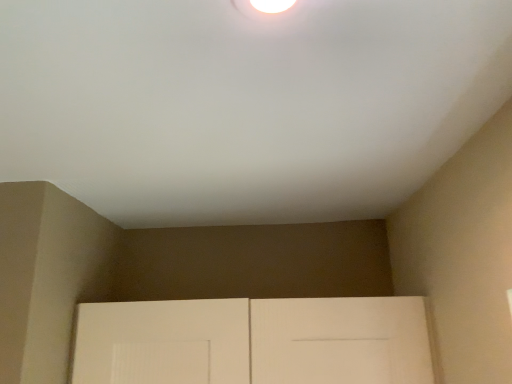
Image resolution: width=512 pixels, height=384 pixels. What do you see at coordinates (270, 10) in the screenshot? I see `white glossy droplight at upper center` at bounding box center [270, 10].

I want to click on white glossy droplight at upper center, so click(270, 10).

This screenshot has width=512, height=384. Find the location of `white matte door at lower center`. white matte door at lower center is located at coordinates (254, 341).

Describe the element at coordinates (254, 341) in the screenshot. I see `white matte door at lower center` at that location.

Find the location of `white glossy droplight at upper center`. white glossy droplight at upper center is located at coordinates (270, 10).

Would you say white matte door at lower center is to the left or to the right of white glossy droplight at upper center in the picture?

From the image, it's evident that white matte door at lower center is to the left of white glossy droplight at upper center.

In the image, is white matte door at lower center positioned in front of or behind white glossy droplight at upper center?

Clearly, white matte door at lower center is behind white glossy droplight at upper center.

Is point (166, 339) closer or farther from the camera than point (298, 11)?

Point (166, 339) is farther from the camera than point (298, 11).

From the image's perspective, is white matte door at lower center over white glossy droplight at upper center?

Incorrect, from the image's perspective, white matte door at lower center is lower than white glossy droplight at upper center.

From the picture: From a real-world perspective, is white matte door at lower center physically located above or below white glossy droplight at upper center?

white matte door at lower center is situated lower than white glossy droplight at upper center in the real world.

Is white matte door at lower center wider than white glossy droplight at upper center?

Indeed, white matte door at lower center has a greater width compared to white glossy droplight at upper center.

In the scene shown: Between white matte door at lower center and white glossy droplight at upper center, which one has less height?

Standing shorter between the two is white glossy droplight at upper center.

Can you confirm if white matte door at lower center is bigger than white glossy droplight at upper center?

Correct, white matte door at lower center is larger in size than white glossy droplight at upper center.

Would you say white matte door at lower center is outside white glossy droplight at upper center?

Yes, white matte door at lower center is located beyond the bounds of white glossy droplight at upper center.

Is white matte door at lower center next to white glossy droplight at upper center?

No, white matte door at lower center is not making contact with white glossy droplight at upper center.

Is white matte door at lower center aimed at white glossy droplight at upper center?

No, white matte door at lower center is not oriented towards white glossy droplight at upper center.

How many degrees apart are the facing directions of white matte door at lower center and white glossy droplight at upper center?

The facing directions of white matte door at lower center and white glossy droplight at upper center are 89.3 degrees apart.

Measure the distance from white matte door at lower center to white glossy droplight at upper center.

white matte door at lower center and white glossy droplight at upper center are 33.36 inches apart.

Where is `droplight above the white matte door at lower center (from a real-world perspective)`? droplight above the white matte door at lower center (from a real-world perspective) is located at coordinates (270, 10).

Considering the relative positions of white glossy droplight at upper center and white matte door at lower center in the image provided, is white glossy droplight at upper center to the left of white matte door at lower center from the viewer's perspective?

No, white glossy droplight at upper center is not to the left of white matte door at lower center.

Considering the relative positions of white glossy droplight at upper center and white matte door at lower center in the image provided, is white glossy droplight at upper center in front of white matte door at lower center?

That is True.

Does point (298, 3) come in front of point (412, 297)?

Yes, point (298, 3) is closer to viewer.

From the image's perspective, which one is positioned higher, white glossy droplight at upper center or white matte door at lower center?

white glossy droplight at upper center is shown above in the image.

From a real-world perspective, is white glossy droplight at upper center on top of white matte door at lower center?

Yes, from a real-world perspective, white glossy droplight at upper center is above white matte door at lower center.

Consider the image. Is white glossy droplight at upper center wider or thinner than white matte door at lower center?

In the image, white glossy droplight at upper center appears to be more narrow than white matte door at lower center.

Considering the sizes of objects white glossy droplight at upper center and white matte door at lower center in the image provided, who is shorter, white glossy droplight at upper center or white matte door at lower center?

white glossy droplight at upper center is shorter.

Considering the relative sizes of white glossy droplight at upper center and white matte door at lower center in the image provided, is white glossy droplight at upper center smaller than white matte door at lower center?

Correct, white glossy droplight at upper center occupies less space than white matte door at lower center.

Would you say white glossy droplight at upper center is outside white matte door at lower center?

Indeed, white glossy droplight at upper center is completely outside white matte door at lower center.

Are white glossy droplight at upper center and white matte door at lower center beside each other?

No, white glossy droplight at upper center is not beside white matte door at lower center.

Could you tell me if white glossy droplight at upper center is facing white matte door at lower center?

No, white glossy droplight at upper center is not oriented towards white matte door at lower center.

What are the coordinates of `door on the left of white glossy droplight at upper center` in the screenshot? It's located at (254, 341).

Identify the location of door on the left of white glossy droplight at upper center. 254,341.

Find the location of `droplight that appears above the white matte door at lower center (from a real-world perspective)`. droplight that appears above the white matte door at lower center (from a real-world perspective) is located at coordinates (270, 10).